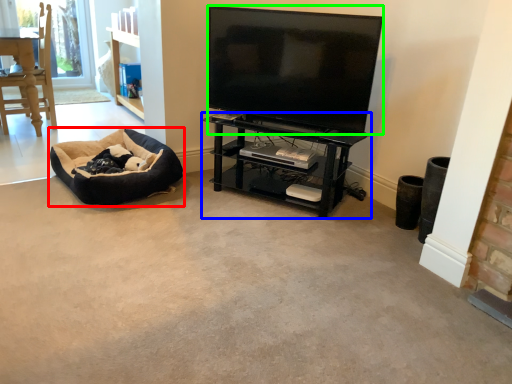
Question: Considering the real-world distances, which object is farthest from dog bed (highlighted by a red box)? shelf (highlighted by a blue box) or television (highlighted by a green box)?

Choices:
 (A) shelf
 (B) television

Answer: (B)